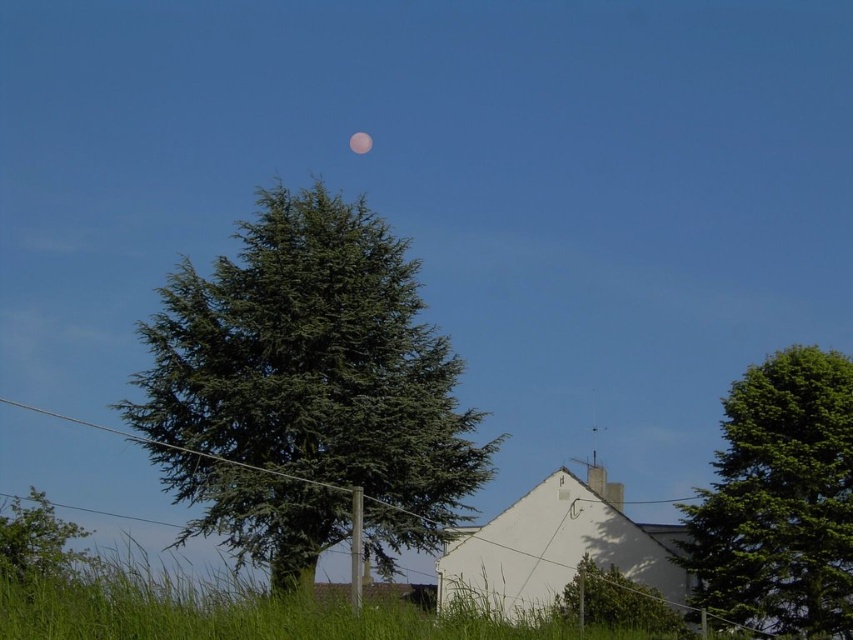
In the scene shown: Is green leafy tree at right further to camera compared to pink translucent moon at upper center?

No, it is not.

Does green leafy tree at right have a lesser height compared to pink translucent moon at upper center?

Incorrect, green leafy tree at right's height does not fall short of pink translucent moon at upper center's.

Who is more distant from viewer, (759, 440) or (360, 154)?

Positioned behind is point (360, 154).

What are the coordinates of `green leafy tree at right` in the screenshot? It's located at (779, 499).

Is green matte tree at lower right taller than green leafy tree at lower left?

In fact, green matte tree at lower right may be shorter than green leafy tree at lower left.

From the picture: Is green matte tree at lower right positioned in front of green leafy tree at lower left?

That is False.

Image resolution: width=853 pixels, height=640 pixels. Describe the element at coordinates (614, 600) in the screenshot. I see `green matte tree at lower right` at that location.

Find the location of a particular element. green matte tree at lower right is located at coordinates coord(614,600).

Is green needle-like at center thinner than green leafy tree at right?

No.

Between green needle-like at center and green leafy tree at right, which one is positioned higher?

Positioned higher is green needle-like at center.

Between point (310, 522) and point (727, 579), which one is positioned in front?

Point (310, 522) is more forward.

Identify the location of green needle-like at center. This screenshot has width=853, height=640. (306, 392).